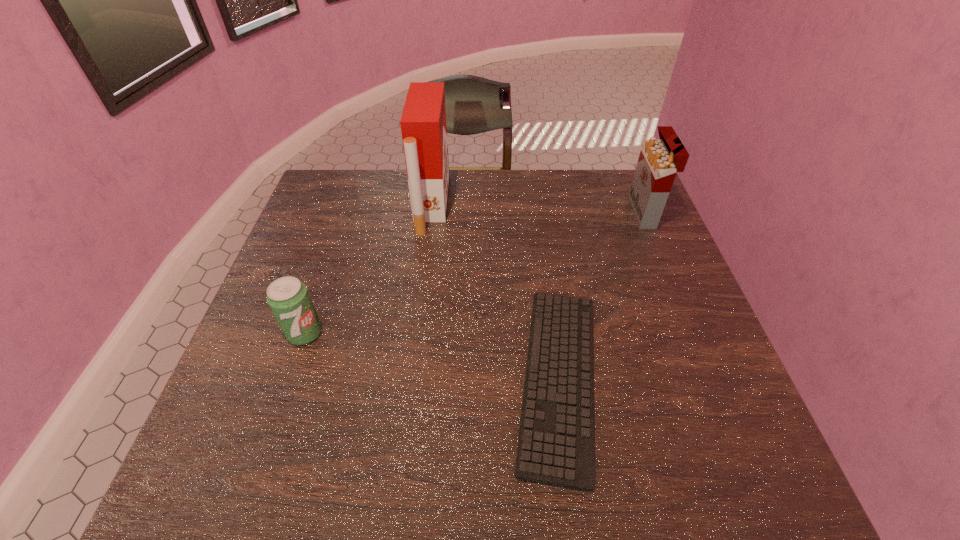
The image size is (960, 540). What are the coordinates of `free region located 0.390m with the lid open on the right cigarette case` in the screenshot? It's located at (503, 213).

Locate an element on the screen. free location located 0.300m with the lid open on the right cigarette case is located at coordinates (533, 213).

Locate an element on the screen. The width and height of the screenshot is (960, 540). free space located on the right of the soda is located at coordinates (362, 333).

I want to click on free spot located 0.060m on the back of the shortest object, so click(x=544, y=280).

The width and height of the screenshot is (960, 540). Identify the location of object at the near edge. (556, 443).

I want to click on object at the left edge, so click(x=288, y=298).

In order to click on object positioned at the right edge in this screenshot , I will do `click(659, 161)`.

The width and height of the screenshot is (960, 540). Identify the location of object at the far right corner. (659, 161).

I want to click on free region at the far edge of the desktop, so click(493, 179).

At what (x,y) coordinates should I click in order to perform the action: click on free space at the near edge of the desktop. Please return your answer as a coordinate pair (x, y). The height and width of the screenshot is (540, 960). Looking at the image, I should click on (479, 447).